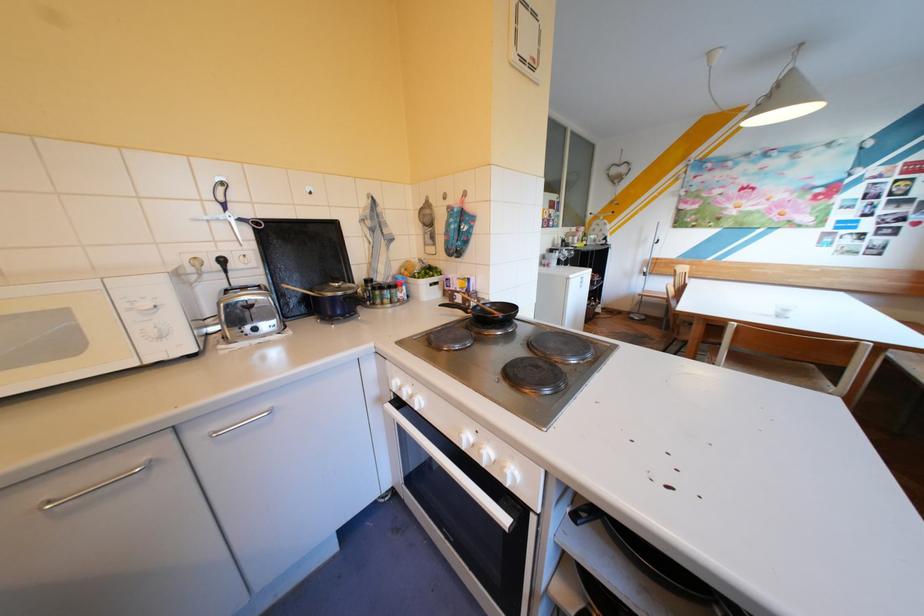
The width and height of the screenshot is (924, 616). Find the location of `blue cooking pot`. blue cooking pot is located at coordinates point(334,300).